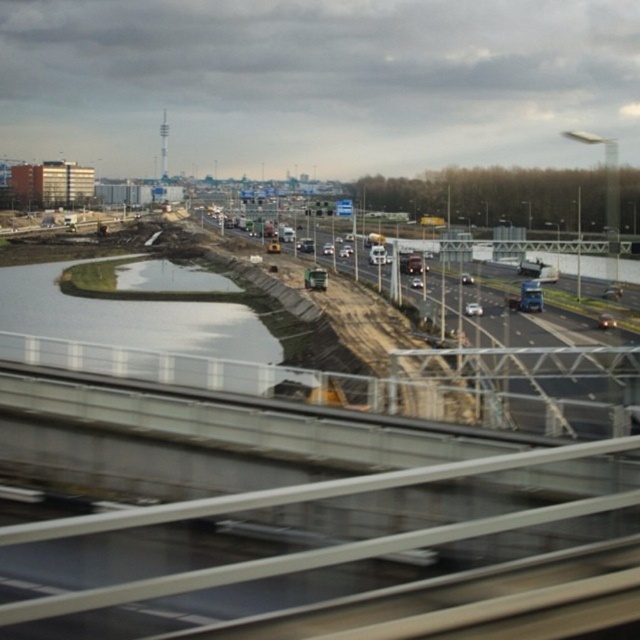
Question: Which of the following is the farthest from the observer?

Choices:
 (A) (518, 364)
 (B) (243, 342)

Answer: (B)

Question: Which of the following is the farthest from the observer?

Choices:
 (A) concrete asphalt highway at center
 (B) smooth concrete water at lower left

Answer: (B)

Question: Does concrete asphalt highway at center appear under smooth concrete water at lower left?

Choices:
 (A) yes
 (B) no

Answer: (A)

Question: Is concrete asphalt highway at center bigger than smooth concrete water at lower left?

Choices:
 (A) no
 (B) yes

Answer: (B)

Question: Which of the following is the closest to the observer?

Choices:
 (A) (573, 349)
 (B) (54, 314)

Answer: (A)

Question: Does concrete asphalt highway at center appear on the left side of smooth concrete water at lower left?

Choices:
 (A) yes
 (B) no

Answer: (B)